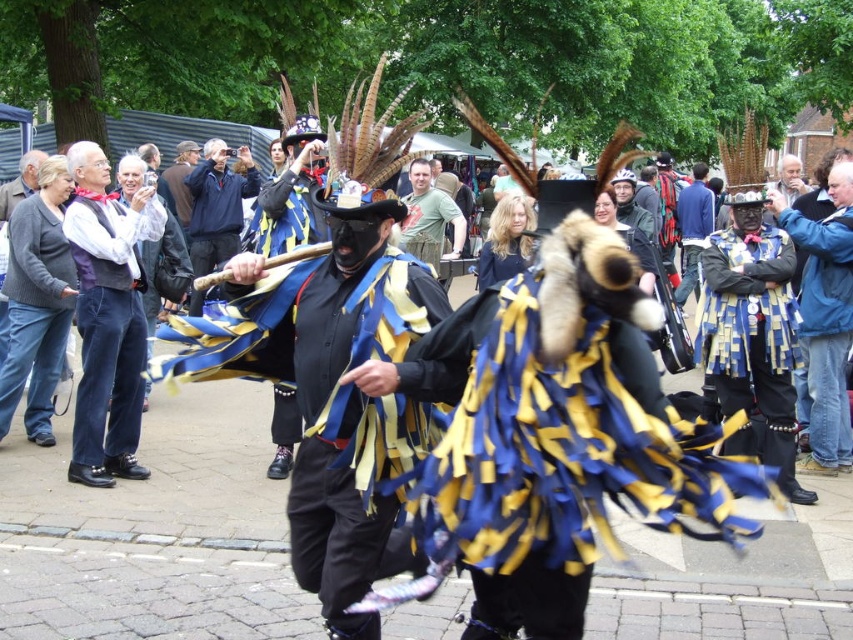
Question: Is blue and yellow fabric at center positioned before blue/yellow fabric cape at center-right?

Choices:
 (A) yes
 (B) no

Answer: (A)

Question: Does knitted gray sweater at left lie behind blue fabric mask at center?

Choices:
 (A) yes
 (B) no

Answer: (B)

Question: Is matte black vest at left thinner than blue and yellow fabric mask at center?

Choices:
 (A) yes
 (B) no

Answer: (A)

Question: Which is farther from the matte black vest at left?

Choices:
 (A) blue and yellow fabric at center
 (B) knitted gray sweater at left
 (C) blue/yellow fabric cape at center-right

Answer: (C)

Question: Which point is farther from the camera taking this photo?

Choices:
 (A) (248, 170)
 (B) (709, 257)
 (C) (100, 333)
 (D) (520, 625)

Answer: (A)

Question: Estimate the real-world distances between objects in this image. Which object is farther from the blue and yellow fabric mask at center?

Choices:
 (A) blue and yellow fabric at center
 (B) green t-shirt at center

Answer: (A)